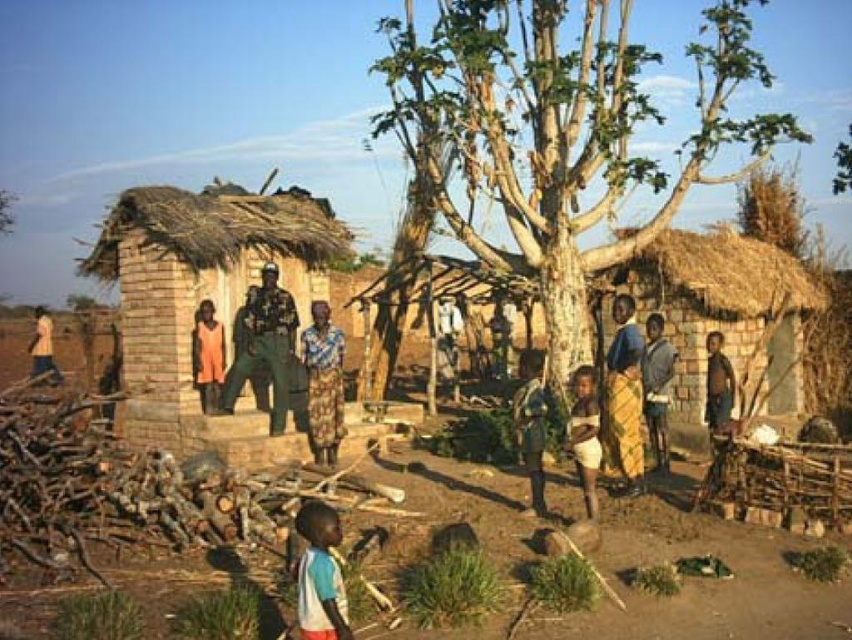
You are a photographer trying to capture a photo of the brown dirt field at center and the patterned fabric dress at center. Based on their positions, which object should you focus on first to ensure both are in sharp focus?

The brown dirt field at center is in front of the patterned fabric dress at center, so you should focus on the brown dirt field at center first to ensure both are in sharp focus.

You are a photographer trying to capture both the brown rough bark tree at center and the patterned fabric dress at center in a single frame. Since the tree is wider than the dress, how should you position your camera to ensure both are fully visible?

To capture both the brown rough bark tree at center and the patterned fabric dress at center in a single frame, position the camera so that the wider brown rough bark tree at center is centered, allowing enough space on the sides to include the narrower patterned fabric dress at center. This ensures both objects are fully visible without cropping either.

You are standing at the point labeled point (634, 376) and want to walk towards the point labeled point (327, 364). Given that there are no obstacles between them, will you be moving towards the foreground or background of the image?

You will be moving towards the background of the image because point (634, 376) is in front of point (327, 364), meaning the latter is located further back.